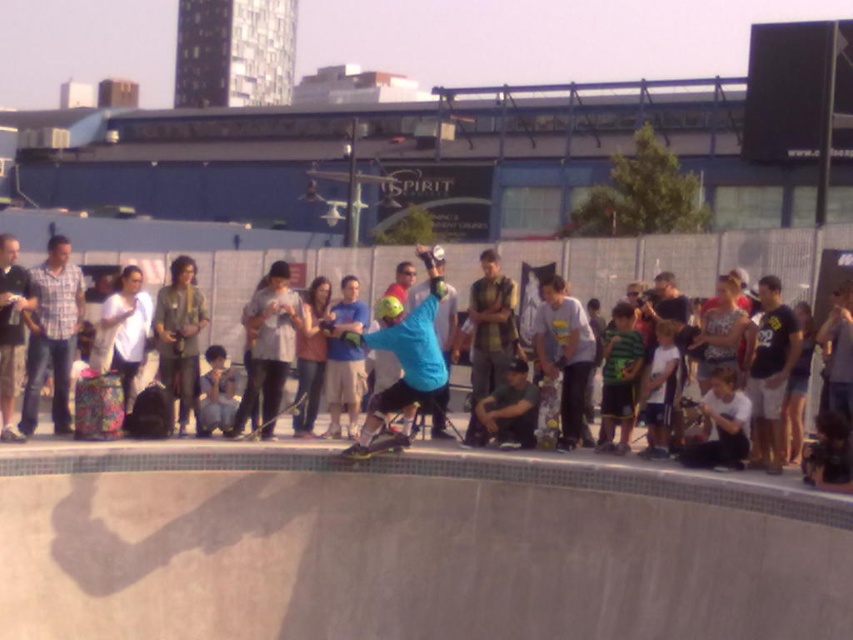
You are a photographer at the skateboarding event. You need to capture a photo of the dark gray cotton shirt at left. Where should you position your camera to ensure the shirt is in the frame?

The dark gray cotton shirt at left is located at the 2D coordinates point (10, 330), so position your camera to face the left side of the scene at that coordinate point to include the dark gray cotton shirt at left in the frame.

You are a photographer at the skateboarding event. You need to capture a photo where the matte black skateboarder at center is clearly visible. Since the green helmet at center is also in the frame, will the skateboarder be above or below the helmet in the photo?

The matte black skateboarder at center is above the green helmet at center in the photo.